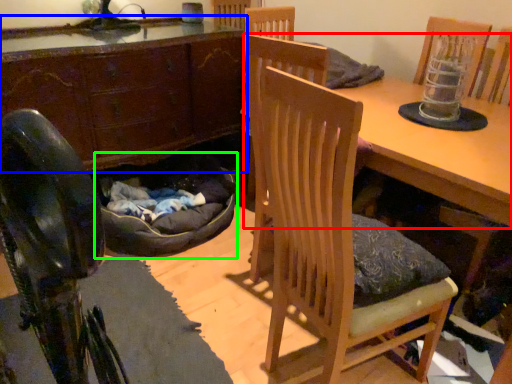
Question: Which is nearer to the table (highlighted by a red box)? cabinetry (highlighted by a blue box) or bean bag chair (highlighted by a green box).

Choices:
 (A) cabinetry
 (B) bean bag chair

Answer: (B)